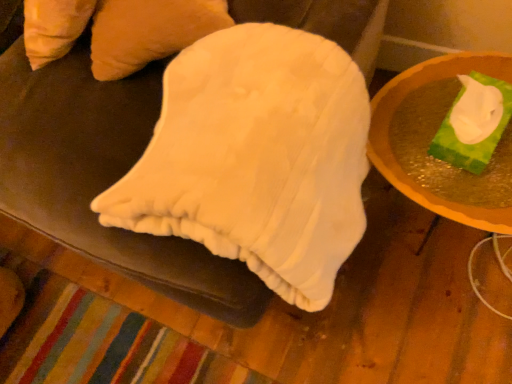
Question: Is green matte tissue box at right further to camera compared to matte white tissue box at right?

Choices:
 (A) no
 (B) yes

Answer: (B)

Question: Considering the relative sizes of green matte tissue box at right and matte white tissue box at right in the image provided, is green matte tissue box at right taller than matte white tissue box at right?

Choices:
 (A) no
 (B) yes

Answer: (A)

Question: Does green matte tissue box at right come in front of matte white tissue box at right?

Choices:
 (A) no
 (B) yes

Answer: (A)

Question: Is green matte tissue box at right not near matte white tissue box at right?

Choices:
 (A) no
 (B) yes

Answer: (A)

Question: From the image's perspective, is green matte tissue box at right below matte white tissue box at right?

Choices:
 (A) yes
 (B) no

Answer: (A)

Question: From the image's perspective, is green matte tissue box at right over matte white tissue box at right?

Choices:
 (A) yes
 (B) no

Answer: (B)

Question: From the image's perspective, would you say matte white tissue box at right is shown under green matte tissue box at right?

Choices:
 (A) yes
 (B) no

Answer: (B)

Question: Would you say matte white tissue box at right contains green matte tissue box at right?

Choices:
 (A) yes
 (B) no

Answer: (B)

Question: Is matte white tissue box at right at the right side of green matte tissue box at right?

Choices:
 (A) no
 (B) yes

Answer: (A)

Question: Is matte white tissue box at right to the left of green matte tissue box at right from the viewer's perspective?

Choices:
 (A) yes
 (B) no

Answer: (A)

Question: From the image's perspective, is matte white tissue box at right above green matte tissue box at right?

Choices:
 (A) yes
 (B) no

Answer: (A)

Question: From a real-world perspective, is matte white tissue box at right physically above green matte tissue box at right?

Choices:
 (A) no
 (B) yes

Answer: (A)

Question: Relative to green matte tissue box at right, is matte white tissue box at right in front or behind?

Choices:
 (A) behind
 (B) front

Answer: (B)